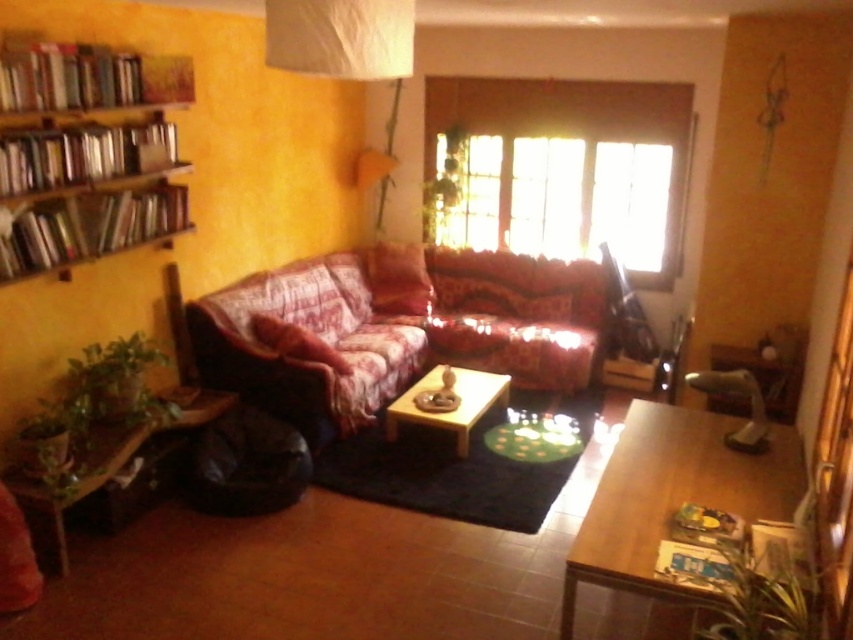
Question: In this image, where is wooden table at lower right located relative to wooden coffee table at center?

Choices:
 (A) above
 (B) below

Answer: (B)

Question: Which point is closer to the camera?

Choices:
 (A) (91, 465)
 (B) (35, 198)
 (C) (496, 397)
 (D) (376, 260)

Answer: (A)

Question: Where is wooden shelves at left located in relation to white paper lampshade at upper center in the image?

Choices:
 (A) right
 (B) left

Answer: (B)

Question: Which point is closer to the camera taking this photo?

Choices:
 (A) (396, 428)
 (B) (326, 12)
 (C) (233, 304)
 (D) (163, 234)

Answer: (B)

Question: Does floral fabric couch at center appear on the left side of green wood table at lower left?

Choices:
 (A) no
 (B) yes

Answer: (A)

Question: Based on their relative distances, which object is nearer to the wooden table at lower right?

Choices:
 (A) white paper lampshade at upper center
 (B) wooden shelves at left

Answer: (A)